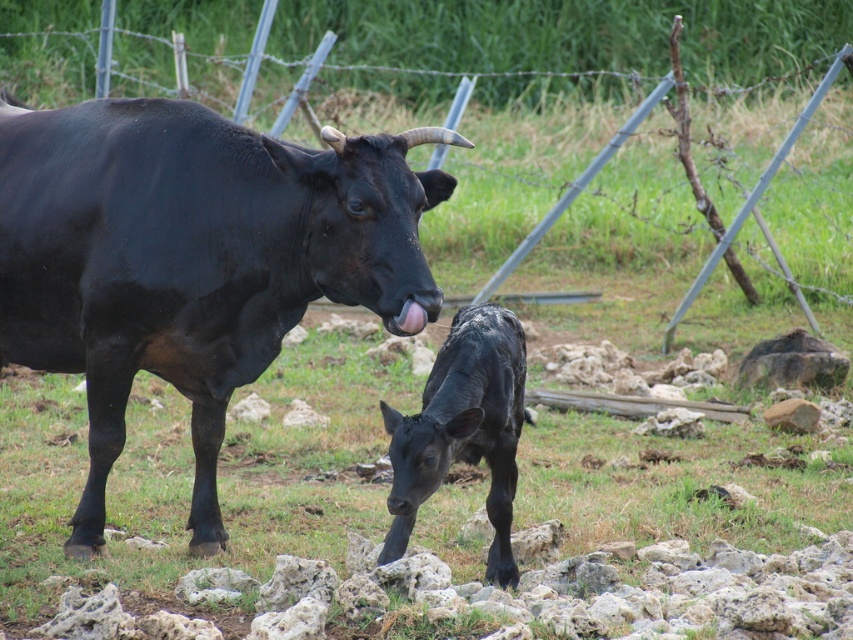
You are a farmer checking the field. You see the shiny black buffalo at upper left and the black glossy calf at center. Which one is positioned higher in the image?

The shiny black buffalo at upper left is positioned higher in the image than the black glossy calf at center.

You are a farmer checking the field. You see the shiny black buffalo at upper left and the black glossy calf at center. Which one is positioned more to the left side of the field?

The shiny black buffalo at upper left is positioned more to the left side of the field than the black glossy calf at center.

Consider the image. You are a farmer standing at the center of the field. You want to locate the shiny black buffalo at upper left. According to the coordinates provided, where should you look relative to your position?

The shiny black buffalo at upper left is located at coordinates point (192,259), which means it is positioned to the left and slightly above your current position as a farmer standing at the center of the field.